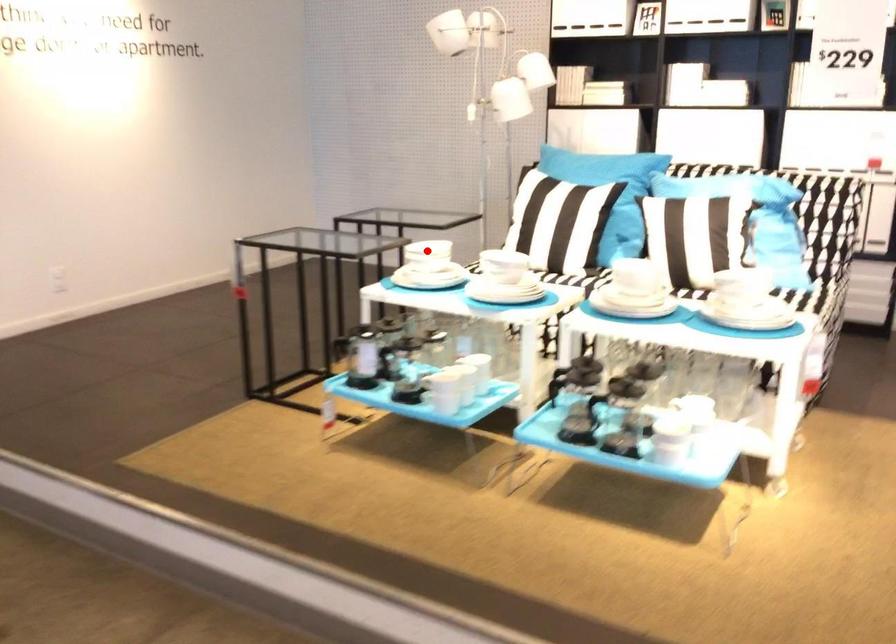
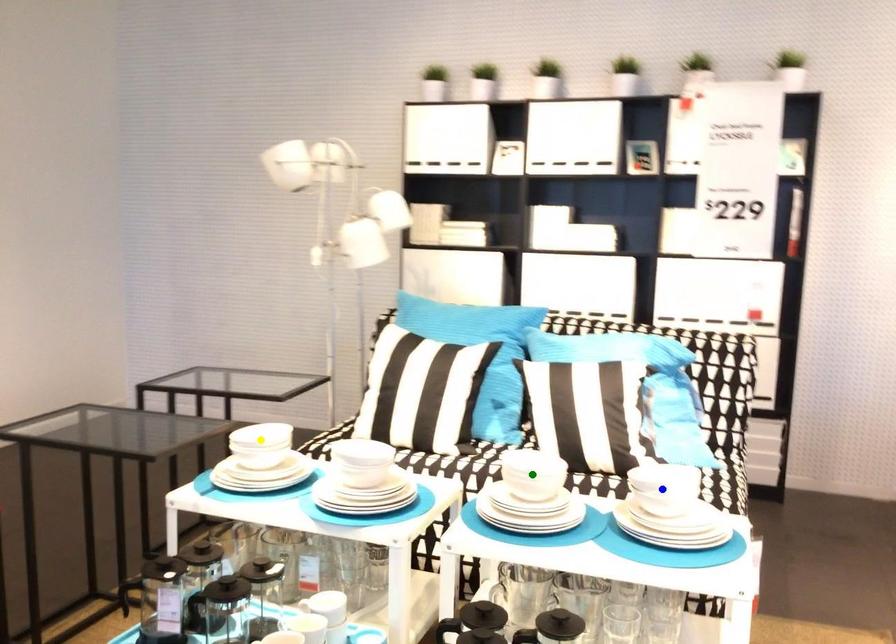
Question: I am providing you with two images of the same scene from different viewpoints. A red point is marked on the first image. You are given multiple points on the second image. In image 2, which mark is for the same physical point as the one in image 1?

Choices:
 (A) yellow point
 (B) green point
 (C) blue point

Answer: (A)